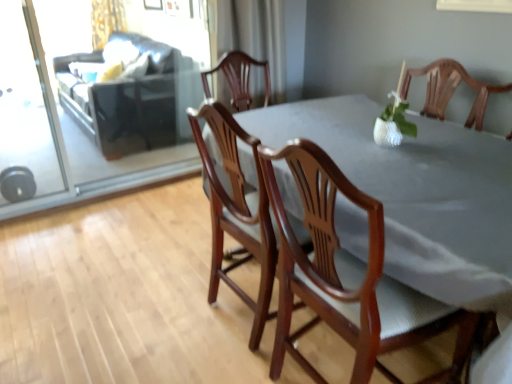
You are a GUI agent. You are given a task and a screenshot of the screen. Output one action in this format:
    pyautogui.click(x=<x>, y=<y>)
    Task: Click on the mahogany wood chair at center, which is counted as the 2th chair, starting from the left
    This screenshot has height=384, width=512.
    Given the screenshot: What is the action you would take?
    pyautogui.click(x=349, y=277)

Describe the element at coordinates (418, 194) in the screenshot. I see `wooden table at center` at that location.

This screenshot has width=512, height=384. What do you see at coordinates (106, 21) in the screenshot?
I see `gold textured curtain at upper left, arranged as the 1th curtain when viewed from the top` at bounding box center [106, 21].

The width and height of the screenshot is (512, 384). What are the coordinates of `clear glass screen door at left, the 2th screen door positioned from the right` in the screenshot? It's located at (27, 117).

Does clear glass screen door at left, acting as the 1th screen door starting from the left, have a greater height compared to wooden chair at center, which is the 2th chair in right-to-left order?

Yes, clear glass screen door at left, acting as the 1th screen door starting from the left, is taller than wooden chair at center, which is the 2th chair in right-to-left order.

Is clear glass screen door at left, acting as the 1th screen door starting from the left, placed right next to wooden chair at center, which is the 2th chair in right-to-left order?

clear glass screen door at left, acting as the 1th screen door starting from the left, and wooden chair at center, which is the 2th chair in right-to-left order, are clearly separated.

Which object is positioned more to the right, clear glass screen door at left, the 2th screen door positioned from the right, or wooden chair at center, acting as the first chair starting from the left?

wooden chair at center, acting as the first chair starting from the left, is more to the right.

In the image, is mahogany wood chair at center, which ranks as the 1th chair in right-to-left order, positioned in front of or behind white sheer curtain at upper center, which is the 2th curtain in back-to-front order?

In the image, mahogany wood chair at center, which ranks as the 1th chair in right-to-left order, appears in front of white sheer curtain at upper center, which is the 2th curtain in back-to-front order.

From a real-world perspective, is mahogany wood chair at center, which ranks as the 1th chair in right-to-left order, physically located above or below white sheer curtain at upper center, the second curtain viewed from the left?

mahogany wood chair at center, which ranks as the 1th chair in right-to-left order, is situated lower than white sheer curtain at upper center, the second curtain viewed from the left, in the real world.

Does mahogany wood chair at center, which ranks as the 1th chair in right-to-left order, turn towards white sheer curtain at upper center, arranged as the 1th curtain when ordered from the bottom?

No.

Considering the relative sizes of mahogany wood chair at center, which ranks as the 1th chair in right-to-left order, and white sheer curtain at upper center, which is the 1th curtain in right-to-left order, in the image provided, is mahogany wood chair at center, which ranks as the 1th chair in right-to-left order, wider than white sheer curtain at upper center, which is the 1th curtain in right-to-left order,?

Yes, mahogany wood chair at center, which ranks as the 1th chair in right-to-left order, is wider than white sheer curtain at upper center, which is the 1th curtain in right-to-left order.

Which is behind, point (308, 298) or point (78, 121)?

The point (78, 121) is more distant.

From the image's perspective, is mahogany wood chair at center, which is counted as the 2th chair, starting from the left, over dark brown leather couch at upper left?

Incorrect, from the image's perspective, mahogany wood chair at center, which is counted as the 2th chair, starting from the left, is lower than dark brown leather couch at upper left.

Is mahogany wood chair at center, which ranks as the 1th chair in right-to-left order, directly adjacent to dark brown leather couch at upper left?

No, mahogany wood chair at center, which ranks as the 1th chair in right-to-left order, is not beside dark brown leather couch at upper left.

Is dark brown leather couch at upper left surrounded by mahogany wood chair at center, which ranks as the 1th chair in right-to-left order?

No, dark brown leather couch at upper left is not inside mahogany wood chair at center, which ranks as the 1th chair in right-to-left order.

From a real-world perspective, who is located higher, transparent glass screen door at upper left, acting as the 2th screen door starting from the left, or gold textured curtain at upper left, the 1th curtain viewed from the back?

From a 3D spatial view, gold textured curtain at upper left, the 1th curtain viewed from the back, is above.

Is transparent glass screen door at upper left, acting as the 2th screen door starting from the left, far away from gold textured curtain at upper left, the 2th curtain ordered from the bottom?

That's right, there is a large distance between transparent glass screen door at upper left, acting as the 2th screen door starting from the left, and gold textured curtain at upper left, the 2th curtain ordered from the bottom.

Looking at this image, considering the sizes of objects transparent glass screen door at upper left, the first screen door in the right-to-left sequence, and gold textured curtain at upper left, which is counted as the first curtain, starting from the left, in the image provided, who is shorter, transparent glass screen door at upper left, the first screen door in the right-to-left sequence, or gold textured curtain at upper left, which is counted as the first curtain, starting from the left,?

gold textured curtain at upper left, which is counted as the first curtain, starting from the left, is shorter.

From the image's perspective, between white sheer curtain at upper center, which is the 2th curtain in back-to-front order, and transparent glass screen door at upper left, the first screen door in the right-to-left sequence, who is located below?

transparent glass screen door at upper left, the first screen door in the right-to-left sequence, is shown below in the image.

Looking at this image, would you say white sheer curtain at upper center, which ranks as the first curtain in front-to-back order, is inside or outside transparent glass screen door at upper left, the first screen door in the right-to-left sequence?

white sheer curtain at upper center, which ranks as the first curtain in front-to-back order, is outside transparent glass screen door at upper left, the first screen door in the right-to-left sequence.

From a real-world perspective, is white sheer curtain at upper center, the second curtain viewed from the left, physically located above or below transparent glass screen door at upper left, the first screen door in the right-to-left sequence?

Clearly, from a real-world perspective, white sheer curtain at upper center, the second curtain viewed from the left, is above transparent glass screen door at upper left, the first screen door in the right-to-left sequence.

Can you confirm if wooden chair at center, acting as the first chair starting from the left, is shorter than dark brown leather couch at upper left?

No.

Considering the sizes of objects wooden chair at center, which is the 2th chair in right-to-left order, and dark brown leather couch at upper left in the image provided, who is bigger, wooden chair at center, which is the 2th chair in right-to-left order, or dark brown leather couch at upper left?

dark brown leather couch at upper left is bigger.

Which is behind, wooden chair at center, which is the 2th chair in right-to-left order, or dark brown leather couch at upper left?

dark brown leather couch at upper left is further away from the camera.

Considering the positions of objects wooden chair at center, acting as the first chair starting from the left, and dark brown leather couch at upper left in the image provided, who is more to the left, wooden chair at center, acting as the first chair starting from the left, or dark brown leather couch at upper left?

dark brown leather couch at upper left is more to the left.

From the image's perspective, is clear glass screen door at left, the 2th screen door positioned from the right, on top of dark brown leather couch at upper left?

No, from the image's perspective, clear glass screen door at left, the 2th screen door positioned from the right, is not above dark brown leather couch at upper left.

In terms of size, does clear glass screen door at left, acting as the 1th screen door starting from the left, appear bigger or smaller than dark brown leather couch at upper left?

clear glass screen door at left, acting as the 1th screen door starting from the left, is smaller than dark brown leather couch at upper left.

Is clear glass screen door at left, acting as the 1th screen door starting from the left, turned away from dark brown leather couch at upper left?

No, clear glass screen door at left, acting as the 1th screen door starting from the left, is not facing the opposite direction of dark brown leather couch at upper left.

Based on the photo, from a real-world perspective, is clear glass screen door at left, the 2th screen door positioned from the right, physically located above or below dark brown leather couch at upper left?

clear glass screen door at left, the 2th screen door positioned from the right, is above dark brown leather couch at upper left.

You are a GUI agent. You are given a task and a screenshot of the screen. Output one action in this format:
    pyautogui.click(x=<x>, y=<y>)
    Task: Click on the 1st chair in front of the clear glass screen door at left, the 2th screen door positioned from the right, starting your count from the anchor
    
    Given the screenshot: What is the action you would take?
    pyautogui.click(x=237, y=212)

Where is `chair that is the 2nd one when counting rightward from the white sheer curtain at upper center, arranged as the 1th curtain when ordered from the bottom`? Image resolution: width=512 pixels, height=384 pixels. chair that is the 2nd one when counting rightward from the white sheer curtain at upper center, arranged as the 1th curtain when ordered from the bottom is located at coordinates (349, 277).

Based on the photo, when comparing their distances from wooden table at center, does wooden chair at center, which is the 2th chair in right-to-left order, or mahogany wood chair at center, which is counted as the 2th chair, starting from the left, seem closer?

Based on the image, mahogany wood chair at center, which is counted as the 2th chair, starting from the left, appears to be nearer to wooden table at center.

Looking at the image, which one is located closer to transparent glass screen door at upper left, acting as the 2th screen door starting from the left, clear glass screen door at left, the 2th screen door positioned from the right, or mahogany wood chair at center, which ranks as the 1th chair in right-to-left order?

The object closer to transparent glass screen door at upper left, acting as the 2th screen door starting from the left, is clear glass screen door at left, the 2th screen door positioned from the right.

From the image, which object appears to be farther from mahogany wood chair at center, which is counted as the 2th chair, starting from the left, wooden chair at center, acting as the first chair starting from the left, or gold textured curtain at upper left, which is counted as the first curtain, starting from the left?

Based on the image, gold textured curtain at upper left, which is counted as the first curtain, starting from the left, appears to be further to mahogany wood chair at center, which is counted as the 2th chair, starting from the left.

Estimate the real-world distances between objects in this image. Which object is further from transparent glass screen door at upper left, acting as the 2th screen door starting from the left, dark brown leather couch at upper left or mahogany wood chair at center, which is counted as the 2th chair, starting from the left?

Among the two, mahogany wood chair at center, which is counted as the 2th chair, starting from the left, is located further to transparent glass screen door at upper left, acting as the 2th screen door starting from the left.

Which object lies nearer to the anchor point clear glass screen door at left, the 2th screen door positioned from the right, gold textured curtain at upper left, the 1th curtain viewed from the back, or wooden chair at center, which is the 2th chair in right-to-left order?

The object closer to clear glass screen door at left, the 2th screen door positioned from the right, is wooden chair at center, which is the 2th chair in right-to-left order.

Based on their spatial positions, is wooden table at center or white sheer curtain at upper center, acting as the 2th curtain starting from the top, further from clear glass screen door at left, the 2th screen door positioned from the right?

wooden table at center is positioned further to the anchor clear glass screen door at left, the 2th screen door positioned from the right.

Estimate the real-world distances between objects in this image. Which object is closer to dark brown leather couch at upper left, transparent glass screen door at upper left, the first screen door in the right-to-left sequence, or clear glass screen door at left, acting as the 1th screen door starting from the left?

Based on the image, transparent glass screen door at upper left, the first screen door in the right-to-left sequence, appears to be nearer to dark brown leather couch at upper left.

Based on their spatial positions, is gold textured curtain at upper left, arranged as the 2th curtain when viewed from the front, or transparent glass screen door at upper left, acting as the 2th screen door starting from the left, closer to clear glass screen door at left, acting as the 1th screen door starting from the left?

transparent glass screen door at upper left, acting as the 2th screen door starting from the left, is closer to clear glass screen door at left, acting as the 1th screen door starting from the left.

Locate an element on the screen. The width and height of the screenshot is (512, 384). curtain positioned between mahogany wood chair at center, which is counted as the 2th chair, starting from the left, and gold textured curtain at upper left, which is counted as the second curtain, starting from the right, from near to far is located at coordinates (255, 36).

Where is `curtain between wooden chair at center, acting as the first chair starting from the left, and gold textured curtain at upper left, which is counted as the first curtain, starting from the left, from front to back`? The image size is (512, 384). curtain between wooden chair at center, acting as the first chair starting from the left, and gold textured curtain at upper left, which is counted as the first curtain, starting from the left, from front to back is located at coordinates (255, 36).

You are a GUI agent. You are given a task and a screenshot of the screen. Output one action in this format:
    pyautogui.click(x=<x>, y=<y>)
    Task: Click on the curtain between wooden table at center and dark brown leather couch at upper left in the front-back direction
    
    Given the screenshot: What is the action you would take?
    pyautogui.click(x=255, y=36)

You are a GUI agent. You are given a task and a screenshot of the screen. Output one action in this format:
    pyautogui.click(x=<x>, y=<y>)
    Task: Click on the couch between transparent glass screen door at upper left, the first screen door in the right-to-left sequence, and gold textured curtain at upper left, the 1th curtain viewed from the back, along the z-axis
    
    Given the screenshot: What is the action you would take?
    pyautogui.click(x=124, y=101)